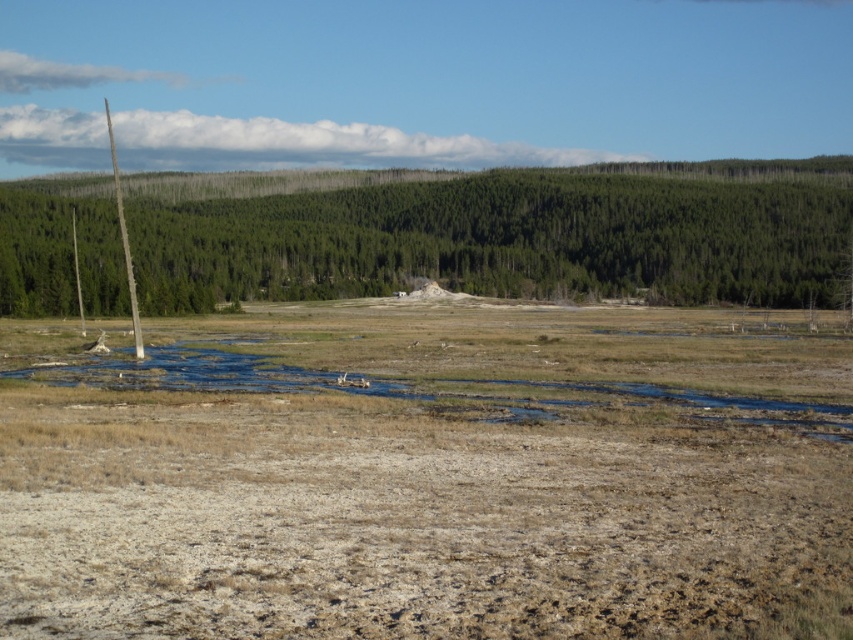
You are a hiker trying to navigate through the dry terrain. You see the brown dry grass at center and the brown wood pole at left. Which object is closer to your current position if you are standing at the right side of the image?

The brown dry grass at center is to the left of the brown wood pole at left, so if you are standing at the right side of the image, the brown dry grass at center would be closer to you since it is positioned further to the left compared to the brown wood pole at left.

You are a hiker trying to navigate through the dry terrain. You see a point marked at coordinates (426, 476). What is located at this point?

The point at coordinates (426, 476) indicates brown dry grass at center.

You are a hiker who wants to cross the cracked ground to reach the forest. You see the brown dry grass at center and the brown wood pole at left. Which object is closer to your current position?

The brown dry grass at center is positioned under the brown wood pole at left, meaning the pole is further away. Therefore, the brown dry grass at center is closer to your current position.